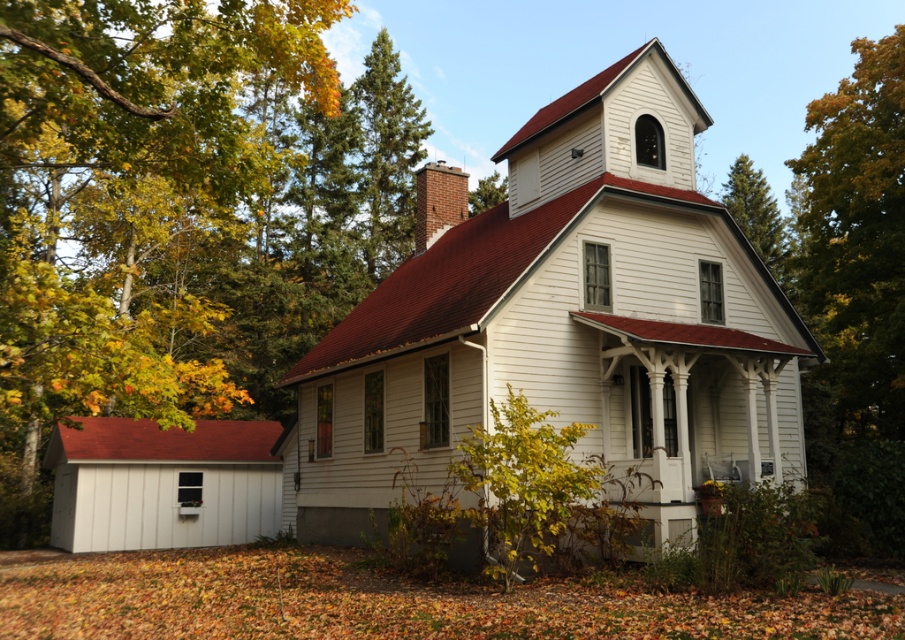
Question: Does green leafy tree at left appear on the right side of green textured pine tree at upper right?

Choices:
 (A) no
 (B) yes

Answer: (A)

Question: Does green textured pine tree at upper right have a greater width compared to green leafy tree at upper center?

Choices:
 (A) no
 (B) yes

Answer: (B)

Question: Which point appears closest to the camera in this image?

Choices:
 (A) (758, 202)
 (B) (641, 296)
 (C) (422, 154)
 (D) (492, 196)

Answer: (B)

Question: Which object is farther from the camera taking this photo?

Choices:
 (A) green leafy tree at upper center
 (B) green leafy tree at left

Answer: (A)

Question: Which object is farther from the camera taking this photo?

Choices:
 (A) green coniferous tree at upper center
 (B) green textured pine tree at upper right

Answer: (A)

Question: Does green leafy tree at left come in front of green coniferous tree at upper center?

Choices:
 (A) yes
 (B) no

Answer: (A)